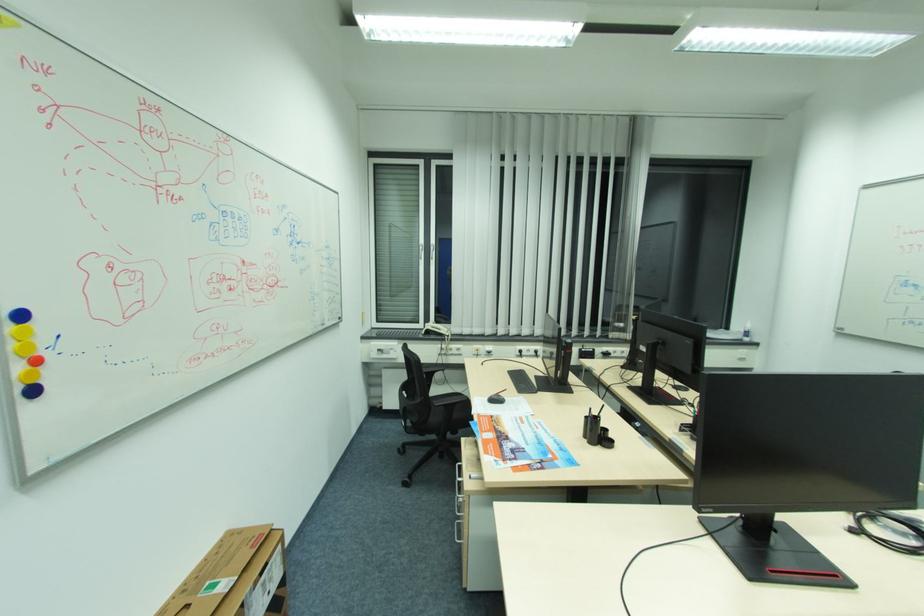
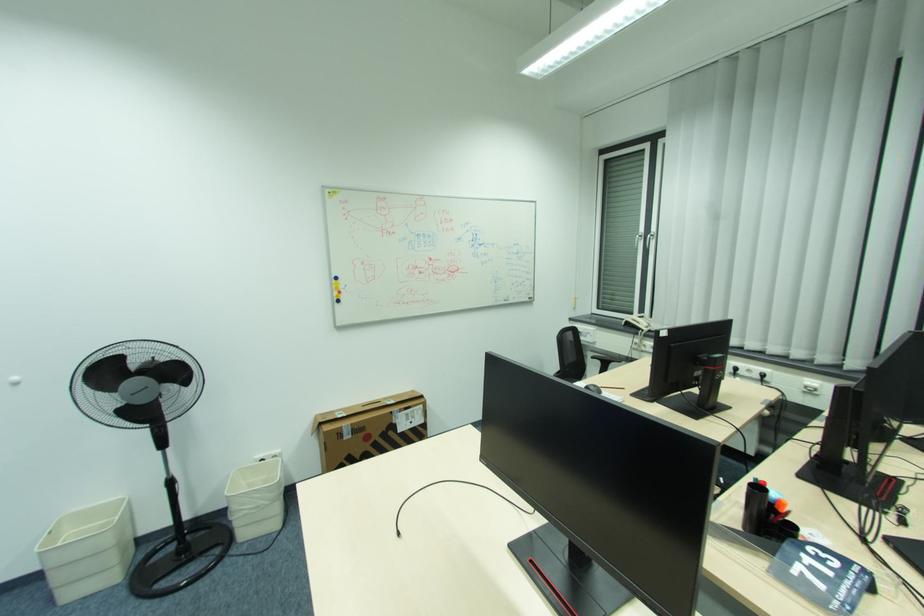
Locate, in the second image, the point that corresponds to point (453, 330) in the first image.

(650, 325)